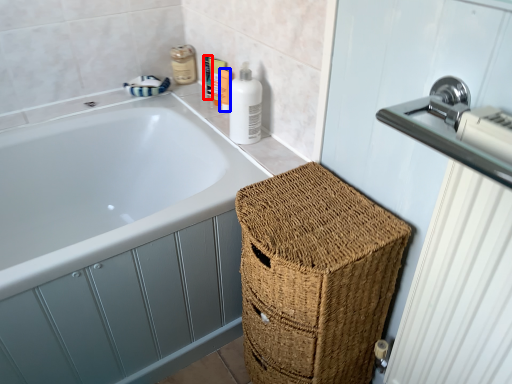
Question: Which object is closer to the camera taking this photo, toiletry (highlighted by a red box) or toiletry (highlighted by a blue box)?

Choices:
 (A) toiletry
 (B) toiletry

Answer: (B)